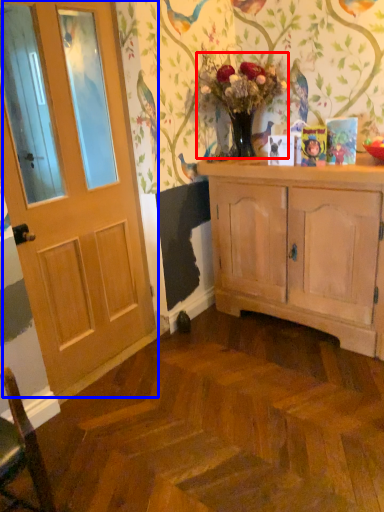
Question: Which object appears farthest to the camera in this image, floral arrangement (highlighted by a red box) or door (highlighted by a blue box)?

Choices:
 (A) floral arrangement
 (B) door

Answer: (A)